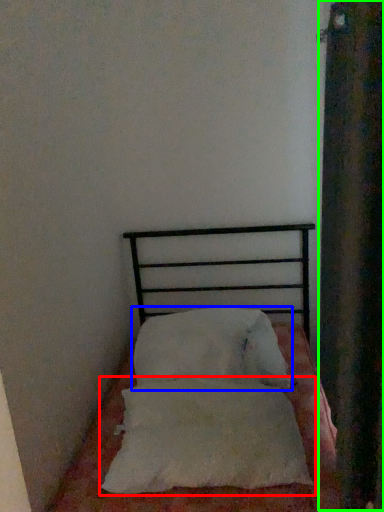
Question: Estimate the real-world distances between objects in this image. Which object is farther from pillow (highlighted by a red box), pillow (highlighted by a blue box) or curtain (highlighted by a green box)?

Choices:
 (A) pillow
 (B) curtain

Answer: (B)